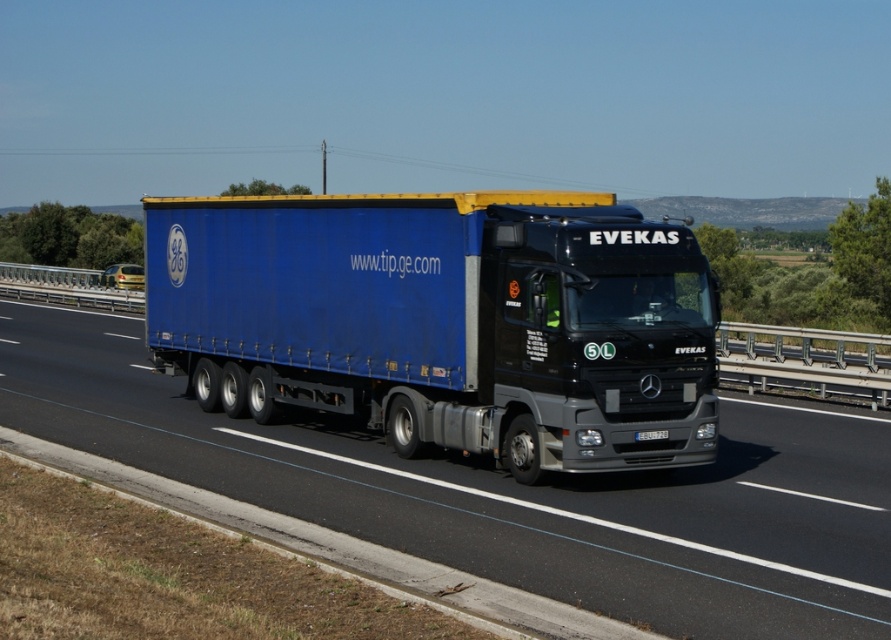
Question: Can you confirm if blue matte trailer truck at center is positioned to the left of blue fabric truck at center?

Choices:
 (A) no
 (B) yes

Answer: (A)

Question: Observing the image, what is the correct spatial positioning of blue matte trailer truck at center in reference to blue fabric truck at center?

Choices:
 (A) right
 (B) left

Answer: (A)

Question: Which object is farther from the camera taking this photo?

Choices:
 (A) blue matte trailer truck at center
 (B) blue fabric truck at center

Answer: (A)

Question: Is blue matte trailer truck at center above blue fabric truck at center?

Choices:
 (A) yes
 (B) no

Answer: (A)

Question: Among these points, which one is nearest to the camera?

Choices:
 (A) (677, 632)
 (B) (325, 252)

Answer: (A)